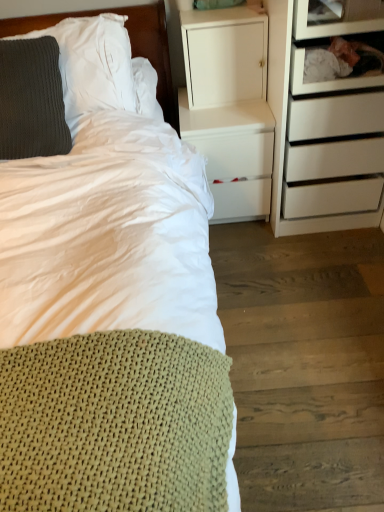
Question: Is wooden drawer at upper right, the 2th shelf from the top, a part of knitted green blanket at lower left?

Choices:
 (A) no
 (B) yes

Answer: (A)

Question: From the image's perspective, is knitted green blanket at lower left on wooden drawer at upper right, positioned as the 1th shelf in bottom-to-top order?

Choices:
 (A) no
 (B) yes

Answer: (A)

Question: Is knitted green blanket at lower left far from wooden drawer at upper right, positioned as the 1th shelf in bottom-to-top order?

Choices:
 (A) yes
 (B) no

Answer: (B)

Question: Is knitted green blanket at lower left further to the viewer compared to wooden drawer at upper right, the 2th shelf from the top?

Choices:
 (A) yes
 (B) no

Answer: (B)

Question: Is knitted green blanket at lower left oriented towards wooden drawer at upper right, the 2th shelf from the top?

Choices:
 (A) yes
 (B) no

Answer: (B)

Question: Is knitted green blanket at lower left smaller than wooden drawer at upper right, positioned as the 1th shelf in bottom-to-top order?

Choices:
 (A) no
 (B) yes

Answer: (A)

Question: Can you confirm if white matte cabinet at upper center is shorter than dark gray knitted pillow at upper left, the 2th pillow from the top?

Choices:
 (A) yes
 (B) no

Answer: (A)

Question: Would you consider white matte cabinet at upper center to be distant from dark gray knitted pillow at upper left, positioned as the 1th pillow in bottom-to-top order?

Choices:
 (A) no
 (B) yes

Answer: (A)

Question: From the image's perspective, is white matte cabinet at upper center above dark gray knitted pillow at upper left, positioned as the 1th pillow in bottom-to-top order?

Choices:
 (A) no
 (B) yes

Answer: (B)

Question: Is white matte cabinet at upper center thinner than dark gray knitted pillow at upper left, the 2th pillow from the top?

Choices:
 (A) yes
 (B) no

Answer: (A)

Question: Is white matte cabinet at upper center turned away from dark gray knitted pillow at upper left, the 2th pillow from the top?

Choices:
 (A) yes
 (B) no

Answer: (B)

Question: Is white matte cabinet at upper center not inside dark gray knitted pillow at upper left, positioned as the 1th pillow in bottom-to-top order?

Choices:
 (A) no
 (B) yes

Answer: (B)

Question: Is transparent glass shelf at upper right, the second shelf ordered from the bottom, to the right of knitted gray pillow at left, which ranks as the 2th pillow in bottom-to-top order, from the viewer's perspective?

Choices:
 (A) no
 (B) yes

Answer: (B)